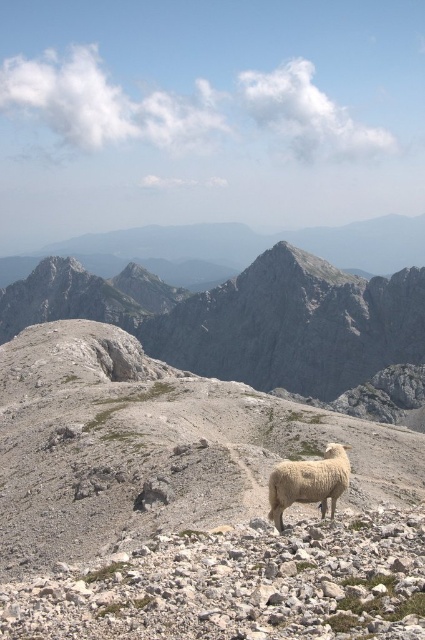
Who is positioned more to the left, gray rocky mountain at center or white woolly sheep at center?

gray rocky mountain at center

Identify the location of gray rocky mountain at center. (243, 317).

Is point (348, 364) positioned after point (325, 451)?

That is True.

You are a GUI agent. You are given a task and a screenshot of the screen. Output one action in this format:
    pyautogui.click(x=<x>, y=<y>)
    Task: Click on the gray rocky mountain at center
    Image resolution: width=425 pixels, height=640 pixels.
    Given the screenshot: What is the action you would take?
    pos(243,317)